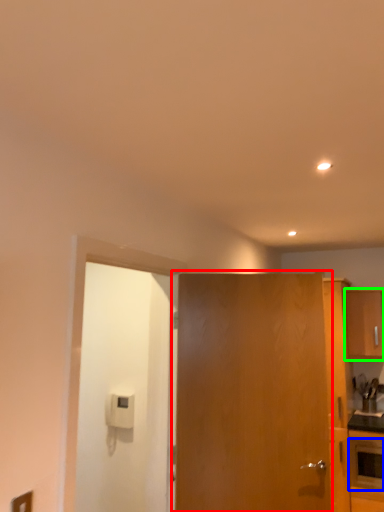
Question: Considering the real-world distances, which object is closest to door (highlighted by a red box)? appliance (highlighted by a blue box) or cabinetry (highlighted by a green box).

Choices:
 (A) appliance
 (B) cabinetry

Answer: (A)